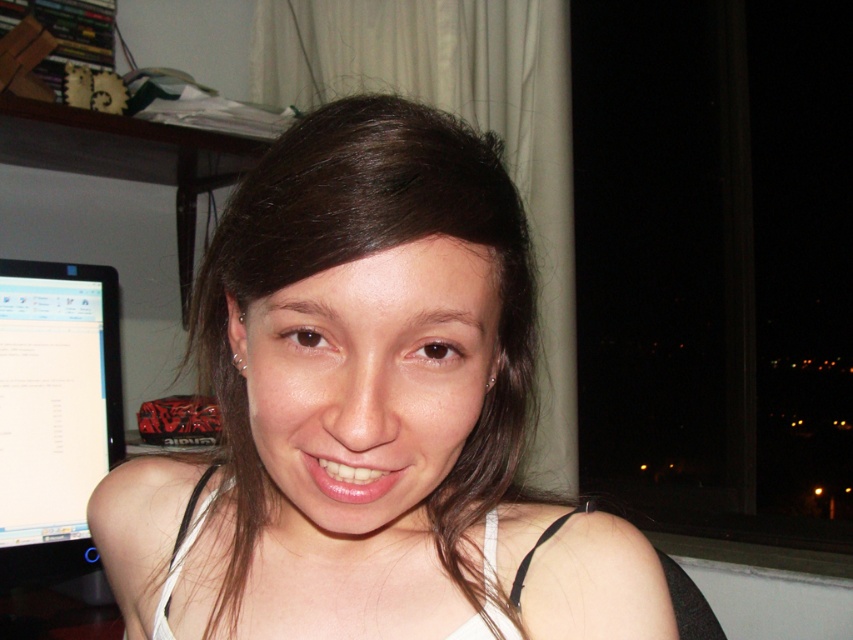
Can you confirm if smooth skin face at center is thinner than black glossy monitor at left?

Incorrect, smooth skin face at center's width is not less than black glossy monitor at left's.

Measure the distance between smooth skin face at center and camera.

11.92 inches

At what (x,y) coordinates should I click in order to perform the action: click on smooth skin face at center. Please return your answer as a coordinate pair (x, y). The image size is (853, 640). Looking at the image, I should click on (368, 413).